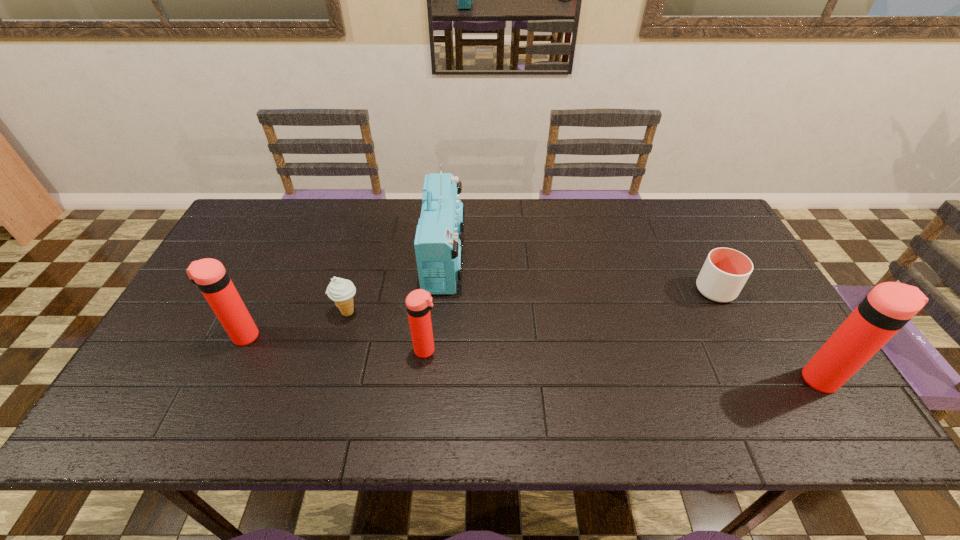
At what (x,y) coordinates should I click in order to perform the action: click on the leftmost thermos bottle. Please return your answer as a coordinate pair (x, y). Looking at the image, I should click on (208, 274).

Find the location of a particular element. The height and width of the screenshot is (540, 960). the leftmost object is located at coordinates click(x=208, y=274).

You are a GUI agent. You are given a task and a screenshot of the screen. Output one action in this format:
    pyautogui.click(x=<x>, y=<y>)
    Task: Click on the second thermos bottle from right to left
    The image size is (960, 540).
    Given the screenshot: What is the action you would take?
    pyautogui.click(x=419, y=303)

The image size is (960, 540). Find the location of `the shortest thermos bottle`. the shortest thermos bottle is located at coordinates (419, 303).

At what (x,y) coordinates should I click in order to perform the action: click on the rightmost object. Please return your answer as a coordinate pair (x, y). The height and width of the screenshot is (540, 960). Looking at the image, I should click on (889, 306).

Locate an element on the screen. This screenshot has width=960, height=540. the nearest thermos bottle is located at coordinates (889, 306).

Locate an element on the screen. This screenshot has height=540, width=960. cup is located at coordinates (725, 271).

The height and width of the screenshot is (540, 960). Identify the location of the shortest object. (725, 271).

This screenshot has width=960, height=540. I want to click on radio receiver, so click(x=438, y=249).

Identify the location of the second object from left to right. (341, 291).